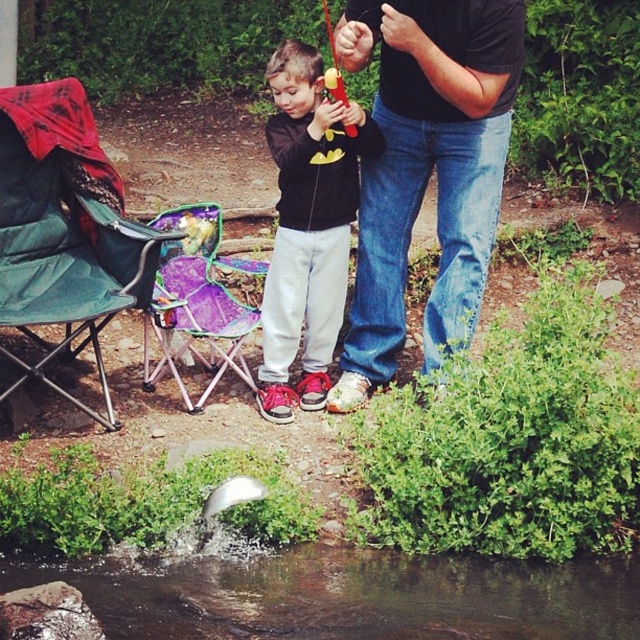
Question: Which object is closer to the camera taking this photo?

Choices:
 (A) matte black hoodie at center
 (B) clear water at lower center
 (C) green fabric chair at left

Answer: (B)

Question: Does clear water at lower center have a lesser width compared to green fabric chair at left?

Choices:
 (A) yes
 (B) no

Answer: (B)

Question: Is clear water at lower center smaller than matte black hoodie at center?

Choices:
 (A) no
 (B) yes

Answer: (B)

Question: Does jeans at center appear under clear water at lower center?

Choices:
 (A) yes
 (B) no

Answer: (B)

Question: Which point is closer to the camera?

Choices:
 (A) jeans at center
 (B) green fabric chair at left
 (C) clear water at lower center
 (D) matte black hoodie at center

Answer: (C)

Question: Which object appears closest to the camera in this image?

Choices:
 (A) green fabric chair at left
 (B) jeans at center

Answer: (B)